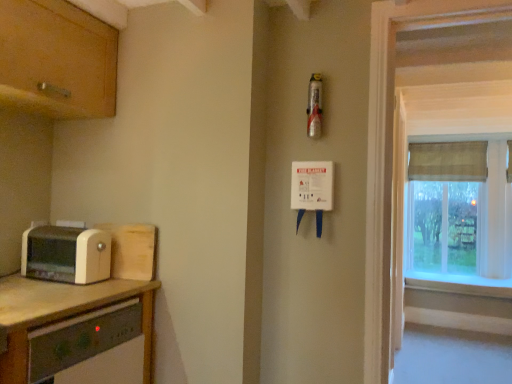
Identify the location of textured beige curtain at right. The image size is (512, 384). (460, 218).

Describe the element at coordinates (460, 218) in the screenshot. Image resolution: width=512 pixels, height=384 pixels. I see `textured beige curtain at right` at that location.

Identify the location of brown fabric curtain at right. [448, 161].

Where is `wooden toaster at left, which is counted as the second cabinetry, starting from the top`? wooden toaster at left, which is counted as the second cabinetry, starting from the top is located at coordinates (132, 250).

What do you see at coordinates (132, 250) in the screenshot? I see `wooden toaster at left, the first cabinetry ordered from the bottom` at bounding box center [132, 250].

Describe the element at coordinates (392, 161) in the screenshot. The height and width of the screenshot is (384, 512). I see `wooden window frame at right` at that location.

I want to click on textured beige curtain at right, so click(460, 218).

Looking at this image, from the image's perspective, is wooden toaster at left, which is counted as the second cabinetry, starting from the top, under white laminate countertop at lower left?

Incorrect, from the image's perspective, wooden toaster at left, which is counted as the second cabinetry, starting from the top, is higher than white laminate countertop at lower left.

Is wooden toaster at left, which is counted as the second cabinetry, starting from the top, completely or partially outside of white laminate countertop at lower left?

Yes, wooden toaster at left, which is counted as the second cabinetry, starting from the top, is located beyond the bounds of white laminate countertop at lower left.

Is point (123, 273) closer to viewer compared to point (15, 285)?

No, it is behind (15, 285).

In terms of height, does wooden toaster at left, the first cabinetry ordered from the bottom, look taller or shorter compared to white laminate countertop at lower left?

Clearly, wooden toaster at left, the first cabinetry ordered from the bottom, is shorter compared to white laminate countertop at lower left.

From the picture: Can you tell me how much wooden toaster at left, the first cabinetry ordered from the bottom, and wooden cabinet at upper left, which ranks as the 2th cabinetry in bottom-to-top order, differ in facing direction?

89.6 degrees.

Is wooden toaster at left, the first cabinetry ordered from the bottom, wider than wooden cabinet at upper left, which ranks as the 2th cabinetry in bottom-to-top order?

In fact, wooden toaster at left, the first cabinetry ordered from the bottom, might be narrower than wooden cabinet at upper left, which ranks as the 2th cabinetry in bottom-to-top order.

Is wooden toaster at left, which is counted as the second cabinetry, starting from the top, to the left or to the right of wooden cabinet at upper left, which is the first cabinetry in top-to-bottom order, in the image?

From the image, it's evident that wooden toaster at left, which is counted as the second cabinetry, starting from the top, is to the right of wooden cabinet at upper left, which is the first cabinetry in top-to-bottom order.

Considering the points (154, 267) and (45, 62), which point is behind, point (154, 267) or point (45, 62)?

Positioned behind is point (154, 267).

From a real-world perspective, is white painted wood at right on brown fabric curtain at right?

No, from a real-world perspective, white painted wood at right is not over brown fabric curtain at right

From the image's perspective, is white painted wood at right located beneath brown fabric curtain at right?

Yes, from the image's perspective, white painted wood at right is below brown fabric curtain at right.

Is white painted wood at right not inside brown fabric curtain at right?

Yes.

In the scene shown: Is white painted wood at right oriented towards brown fabric curtain at right?

No, white painted wood at right is not facing towards brown fabric curtain at right.

Is wooden window frame at right facing towards textured beige curtain at right?

No.

In the image, is wooden window frame at right positioned in front of or behind textured beige curtain at right?

Clearly, wooden window frame at right is in front of textured beige curtain at right.

Who is smaller, wooden window frame at right or textured beige curtain at right?

wooden window frame at right is smaller.

From the image's perspective, which one is positioned higher, wooden window frame at right or textured beige curtain at right?

wooden window frame at right.

Considering the positions of point (484, 288) and point (152, 250), is point (484, 288) closer or farther from the camera than point (152, 250)?

Point (484, 288) is farther from the camera than point (152, 250).

There is a white painted wood at right. Identify the location of the 1st cabinetry above it (from a real-world perspective). (132, 250).

Based on the photo, what's the angular difference between white painted wood at right and wooden toaster at left, the first cabinetry ordered from the bottom,'s facing directions?

4.36 degrees separate the facing orientations of white painted wood at right and wooden toaster at left, the first cabinetry ordered from the bottom.

Looking at their sizes, would you say white painted wood at right is wider or thinner than wooden toaster at left, which is counted as the second cabinetry, starting from the top?

Considering their sizes, white painted wood at right looks broader than wooden toaster at left, which is counted as the second cabinetry, starting from the top.

Find the location of a particular element. Image resolution: width=512 pixels, height=384 pixels. screen door below the textured beige curtain at right (from a real-world perspective) is located at coordinates (398, 220).

Considering the positions of objects textured beige curtain at right and clear plastic screen door at right in the image provided, who is behind, textured beige curtain at right or clear plastic screen door at right?

textured beige curtain at right is further away from the camera.

From a real-world perspective, is textured beige curtain at right on clear plastic screen door at right?

Yes.

Is beige plastic toaster at left far from wooden cabinet at upper left, which ranks as the 2th cabinetry in bottom-to-top order?

Actually, beige plastic toaster at left and wooden cabinet at upper left, which ranks as the 2th cabinetry in bottom-to-top order, are a little close together.

Could you measure the distance between beige plastic toaster at left and wooden cabinet at upper left, which ranks as the 2th cabinetry in bottom-to-top order?

beige plastic toaster at left and wooden cabinet at upper left, which ranks as the 2th cabinetry in bottom-to-top order, are 26.84 inches apart from each other.

In the image, is beige plastic toaster at left on the left side or the right side of wooden cabinet at upper left, which is the first cabinetry in top-to-bottom order?

Based on their positions, beige plastic toaster at left is located to the right of wooden cabinet at upper left, which is the first cabinetry in top-to-bottom order.

From a real-world perspective, is beige plastic toaster at left located beneath wooden cabinet at upper left, which ranks as the 2th cabinetry in bottom-to-top order?

Yes, from a real-world perspective, beige plastic toaster at left is under wooden cabinet at upper left, which ranks as the 2th cabinetry in bottom-to-top order.

Locate an element on the screen. the 2nd cabinetry behind the white laminate countertop at lower left is located at coordinates (x=132, y=250).

Where is `cabinetry located above the wooden toaster at left, which is counted as the second cabinetry, starting from the top (from a real-world perspective)`? This screenshot has height=384, width=512. cabinetry located above the wooden toaster at left, which is counted as the second cabinetry, starting from the top (from a real-world perspective) is located at coordinates (56, 60).

From the picture: From the image, which object appears to be nearer to white laminate countertop at lower left, textured beige curtain at right or wooden window frame at right?

The object closer to white laminate countertop at lower left is wooden window frame at right.

Based on their spatial positions, is white laminate countertop at lower left or wooden cabinet at upper left, which ranks as the 2th cabinetry in bottom-to-top order, closer to wooden window frame at right?

The object closer to wooden window frame at right is white laminate countertop at lower left.

Looking at the image, which one is located further to white painted wood at right, brown fabric curtain at right or white laminate countertop at lower left?

The object further to white painted wood at right is white laminate countertop at lower left.

From the image, which object appears to be nearer to beige plastic toaster at left, white painted wood at right or white laminate countertop at lower left?

The object closer to beige plastic toaster at left is white laminate countertop at lower left.

Which object lies nearer to the anchor point white painted wood at right, wooden cabinet at upper left, which ranks as the 2th cabinetry in bottom-to-top order, or wooden window frame at right?

The object closer to white painted wood at right is wooden window frame at right.

Considering their positions, is wooden cabinet at upper left, which is the first cabinetry in top-to-bottom order, positioned closer to textured beige curtain at right than wooden toaster at left, the first cabinetry ordered from the bottom?

wooden toaster at left, the first cabinetry ordered from the bottom, lies closer to textured beige curtain at right than the other object.

Estimate the real-world distances between objects in this image. Which object is further from clear plastic screen door at right, textured beige curtain at right or white painted wood at right?

textured beige curtain at right is further to clear plastic screen door at right.

From the image, which object appears to be farther from clear plastic screen door at right, brown fabric curtain at right or white painted wood at right?

brown fabric curtain at right is further to clear plastic screen door at right.

The width and height of the screenshot is (512, 384). In order to click on window frame between white laminate countertop at lower left and white painted wood at right in the front-back direction in this screenshot , I will do `click(392, 161)`.

Identify the location of countertop between wooden cabinet at upper left, which is the first cabinetry in top-to-bottom order, and white painted wood at right from left to right. This screenshot has height=384, width=512. (64, 316).

The image size is (512, 384). I want to click on cabinetry between wooden cabinet at upper left, which is the first cabinetry in top-to-bottom order, and white laminate countertop at lower left in the up-down direction, so click(x=132, y=250).

Locate an element on the screen. toaster between wooden cabinet at upper left, which is the first cabinetry in top-to-bottom order, and clear plastic screen door at right from left to right is located at coordinates point(66,254).